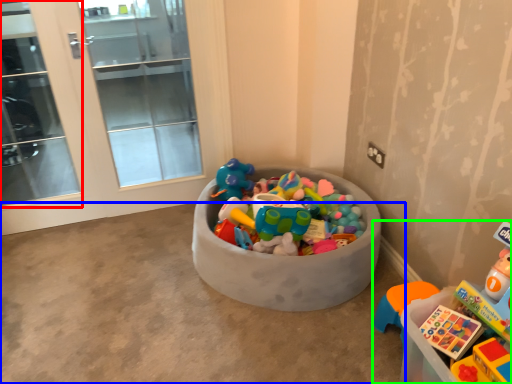
Question: Which object is positioned farthest from screen door (highlighted by a red box)? Select from concrete (highlighted by a blue box) and toy (highlighted by a green box).

Choices:
 (A) concrete
 (B) toy

Answer: (B)